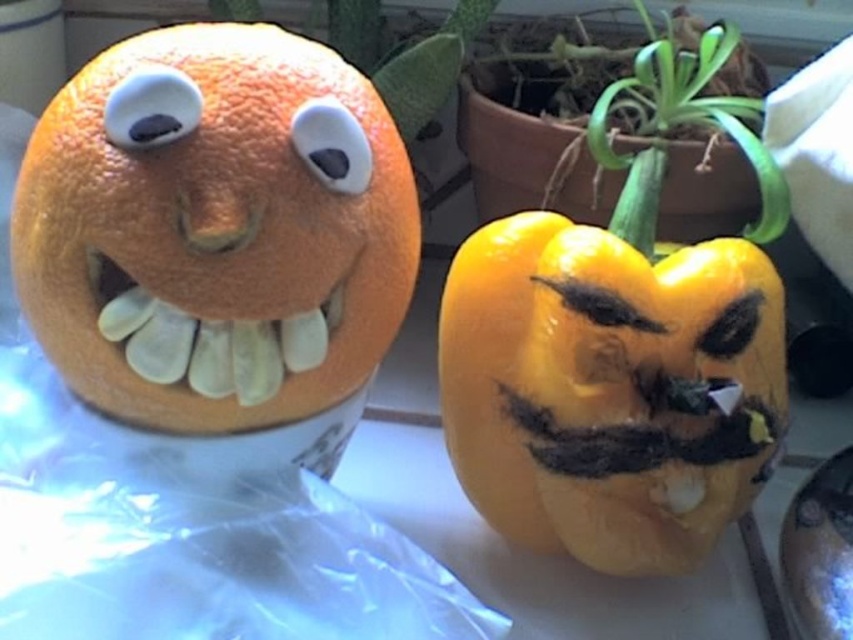
Is green leafy plant at center smaller than matte plastic eye at upper left?

No, green leafy plant at center is not smaller than matte plastic eye at upper left.

Who is taller, green leafy plant at center or matte plastic eye at upper left?

green leafy plant at center is taller.

This screenshot has width=853, height=640. Describe the element at coordinates (625, 129) in the screenshot. I see `green leafy plant at center` at that location.

At what (x,y) coordinates should I click in order to perform the action: click on green leafy plant at center. Please return your answer as a coordinate pair (x, y). Looking at the image, I should click on (625, 129).

Does yellow matte bell pepper at center appear under white matte eye at center?

Yes.

Who is more forward, (502,493) or (323,154)?

Point (323,154)

Locate an element on the screen. The height and width of the screenshot is (640, 853). yellow matte bell pepper at center is located at coordinates (607, 384).

Is orange matte fruit at left below yellow matte bell pepper at center?

Incorrect, orange matte fruit at left is not positioned below yellow matte bell pepper at center.

You are a GUI agent. You are given a task and a screenshot of the screen. Output one action in this format:
    pyautogui.click(x=<x>, y=<y>)
    Task: Click on the orange matte fruit at left
    Image resolution: width=853 pixels, height=640 pixels.
    Given the screenshot: What is the action you would take?
    pyautogui.click(x=215, y=228)

This screenshot has height=640, width=853. What are the coordinates of `orange matte fruit at left` in the screenshot? It's located at (215, 228).